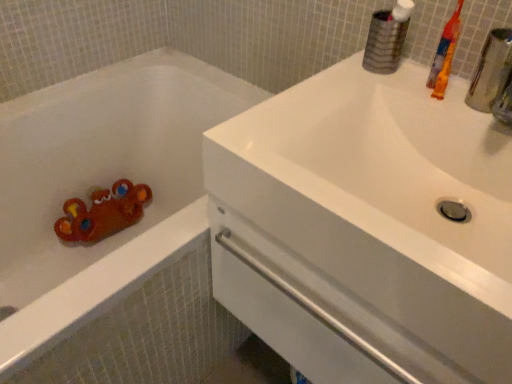
Question: From a real-world perspective, is matte plastic bathtub at left beneath white glossy sink at upper right?

Choices:
 (A) yes
 (B) no

Answer: (A)

Question: Is matte plastic bathtub at left next to white glossy sink at upper right and touching it?

Choices:
 (A) yes
 (B) no

Answer: (B)

Question: Is matte plastic bathtub at left further to camera compared to white glossy sink at upper right?

Choices:
 (A) no
 (B) yes

Answer: (B)

Question: From the image's perspective, is matte plastic bathtub at left located above white glossy sink at upper right?

Choices:
 (A) no
 (B) yes

Answer: (A)

Question: From a real-world perspective, does matte plastic bathtub at left stand above white glossy sink at upper right?

Choices:
 (A) yes
 (B) no

Answer: (B)

Question: Based on their positions, is orange plastic toothbrush at upper right located to the left or right of white glossy sink at upper right?

Choices:
 (A) left
 (B) right

Answer: (B)

Question: In the image, is orange plastic toothbrush at upper right positioned in front of or behind white glossy sink at upper right?

Choices:
 (A) behind
 (B) front

Answer: (A)

Question: Considering the positions of orange plastic toothbrush at upper right and white glossy sink at upper right in the image, is orange plastic toothbrush at upper right bigger or smaller than white glossy sink at upper right?

Choices:
 (A) small
 (B) big

Answer: (A)

Question: Is orange plastic toothbrush at upper right inside or outside of white glossy sink at upper right?

Choices:
 (A) inside
 (B) outside

Answer: (B)

Question: Looking at their shapes, would you say white glossy sink at upper right is wider or thinner than matte plastic bathtub at left?

Choices:
 (A) thin
 (B) wide

Answer: (A)

Question: Is white glossy sink at upper right in front of or behind matte plastic bathtub at left in the image?

Choices:
 (A) front
 (B) behind

Answer: (A)

Question: In terms of size, does white glossy sink at upper right appear bigger or smaller than matte plastic bathtub at left?

Choices:
 (A) big
 (B) small

Answer: (B)

Question: Based on their positions, is white glossy sink at upper right located to the left or right of matte plastic bathtub at left?

Choices:
 (A) left
 (B) right

Answer: (B)

Question: Looking at the image, does matte plastic bathtub at left seem bigger or smaller compared to orange plastic toothbrush at upper right?

Choices:
 (A) small
 (B) big

Answer: (B)

Question: Is matte plastic bathtub at left taller or shorter than orange plastic toothbrush at upper right?

Choices:
 (A) tall
 (B) short

Answer: (A)